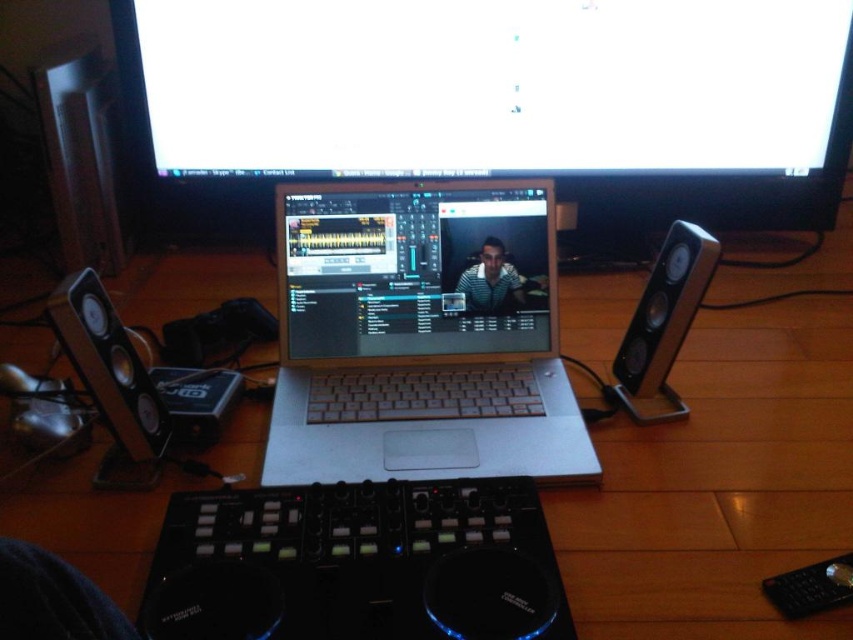
Does point (370, 368) lie in front of point (463, 369)?

No, it is not.

The height and width of the screenshot is (640, 853). Identify the location of silver metallic laptop at center. (421, 336).

Can you confirm if matte black monitor at upper center is positioned to the left of silver metallic laptop at center?

In fact, matte black monitor at upper center is to the right of silver metallic laptop at center.

Does matte black monitor at upper center have a lesser height compared to silver metallic laptop at center?

Indeed, matte black monitor at upper center has a lesser height compared to silver metallic laptop at center.

Where is `matte black monitor at upper center`? matte black monitor at upper center is located at coordinates (492, 104).

At what (x,y) coordinates should I click in order to perform the action: click on matte black monitor at upper center. Please return your answer as a coordinate pair (x, y). Looking at the image, I should click on (492, 104).

Who is shorter, matte black monitor at upper center or matte black laptop at center?

Standing shorter between the two is matte black laptop at center.

Can you confirm if matte black monitor at upper center is positioned to the right of matte black laptop at center?

Indeed, matte black monitor at upper center is positioned on the right side of matte black laptop at center.

Does point (416, 10) lie in front of point (500, 280)?

No, (416, 10) is behind (500, 280).

Locate an element on the screen. matte black monitor at upper center is located at coordinates (492, 104).